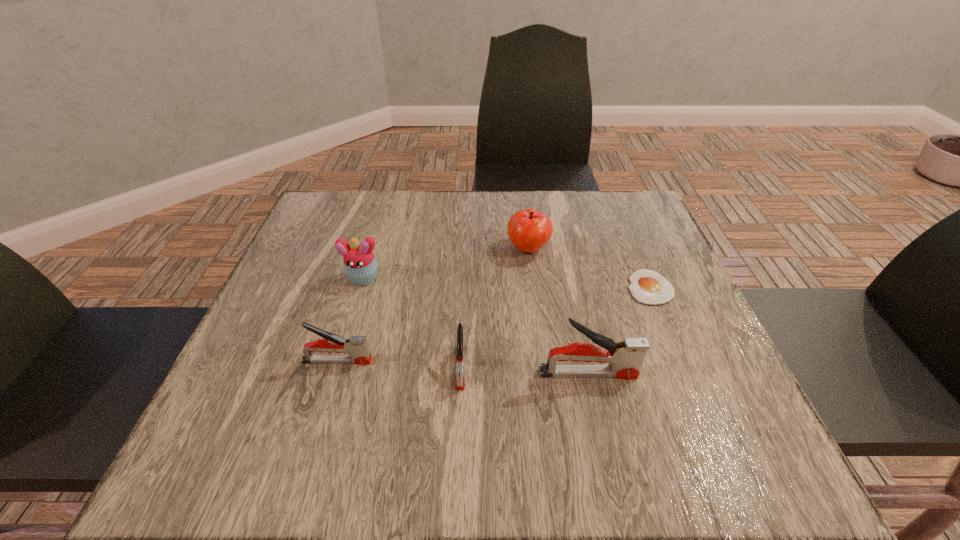
You are a GUI agent. You are given a task and a screenshot of the screen. Output one action in this format:
    pyautogui.click(x=<x>, y=<y>)
    Task: Click on the blank space located on the handle side of the second shortest object
    The image size is (960, 540).
    Given the screenshot: What is the action you would take?
    pyautogui.click(x=459, y=422)

Locate an element on the screen. This screenshot has height=540, width=960. free space located 0.110m on the handle side of the tallest stapler is located at coordinates (697, 374).

Identify the location of vacant region located on the back of the apple. (524, 218).

Locate an element on the screen. The image size is (960, 540). vacant region located 0.110m on the left of the rightmost object is located at coordinates (577, 287).

The height and width of the screenshot is (540, 960). Identify the location of vacant space situated 0.170m on the face of the cupcake. (342, 351).

Image resolution: width=960 pixels, height=540 pixels. Identify the location of object located in the far edge section of the desktop. (529, 230).

The height and width of the screenshot is (540, 960). Find the location of `stapler located in the left edge section of the desktop`. stapler located in the left edge section of the desktop is located at coordinates (357, 347).

Where is `cupcake located in the left edge section of the desktop`? cupcake located in the left edge section of the desktop is located at coordinates (360, 266).

This screenshot has height=540, width=960. In order to click on object present at the right edge in this screenshot , I will do `click(647, 286)`.

In the image, there is a desktop. Identify the location of blank space at the far edge. The image size is (960, 540). (474, 234).